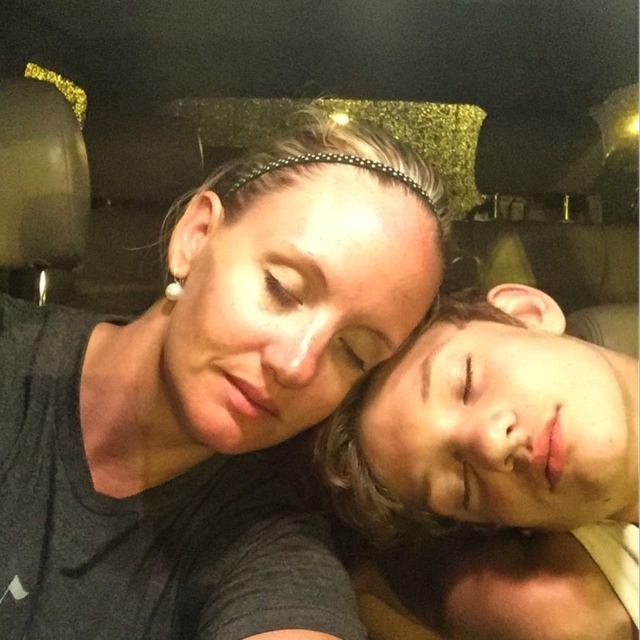
In the scene shown: Who is more distant from viewer, (179,264) or (532,573)?

The point (532,573) is behind.

Can you confirm if matte black hair at center is smaller than smooth skin face at right?

Indeed, matte black hair at center has a smaller size compared to smooth skin face at right.

Is point (209, 396) more distant than point (544, 324)?

That is False.

This screenshot has width=640, height=640. I want to click on matte black hair at center, so click(x=202, y=416).